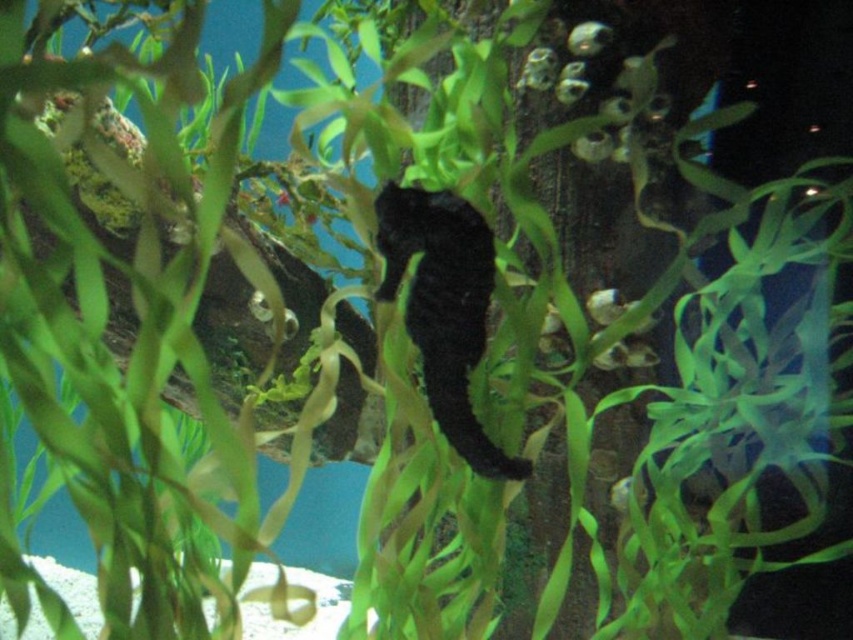
From the picture: Which of these two, shiny silver fish at upper center or translucent green fish at center, stands shorter?

With less height is shiny silver fish at upper center.

Locate an element on the screen. The width and height of the screenshot is (853, 640). shiny silver fish at upper center is located at coordinates 589,36.

Measure the distance from black matte seahorse at center to shiny silver fish at upper center.

The distance of black matte seahorse at center from shiny silver fish at upper center is 20.11 inches.

Can you confirm if black matte seahorse at center is bigger than shiny silver fish at upper center?

Indeed, black matte seahorse at center has a larger size compared to shiny silver fish at upper center.

Between point (392, 209) and point (579, 44), which one is positioned behind?

The point (579, 44) is behind.

Locate an element on the screen. The height and width of the screenshot is (640, 853). black matte seahorse at center is located at coordinates (444, 307).

Which is in front, point (445, 204) or point (619, 483)?

Point (445, 204) is in front.

Who is taller, black matte seahorse at center or translucent green fish at center?

Standing taller between the two is black matte seahorse at center.

Which is behind, point (422, 364) or point (619, 502)?

The point (619, 502) is more distant.

Identify the location of black matte seahorse at center. (444, 307).